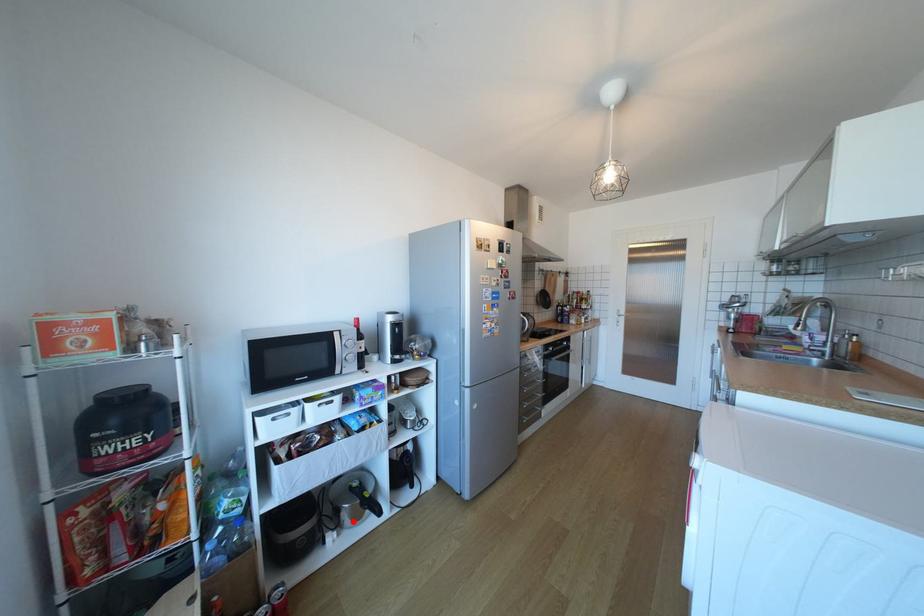
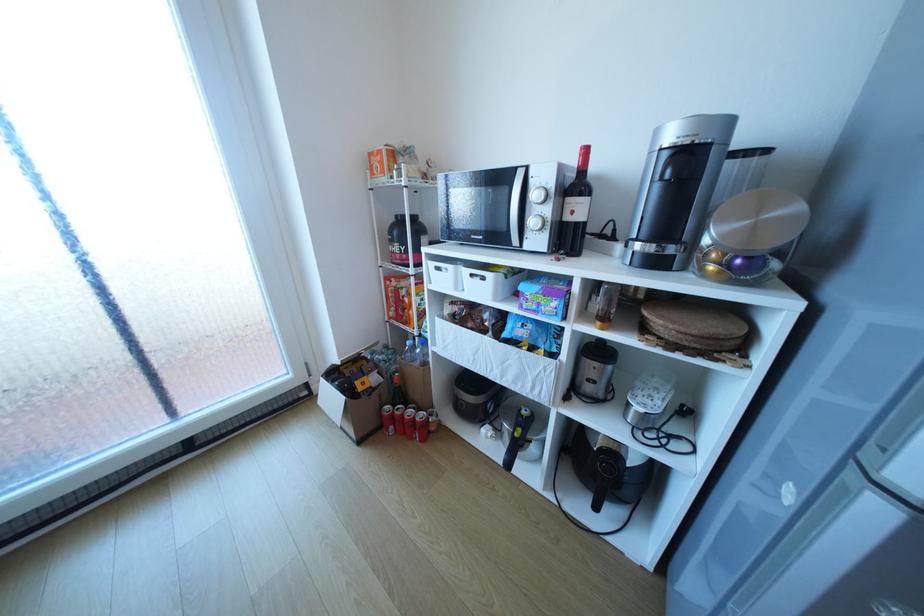
Question: I am providing you with two images of the same scene from different viewpoints. In image1, a red point is highlighted. Considering the same 3D point in image2, which of the following is correct?

Choices:
 (A) It is closer
 (B) It is farther

Answer: (A)